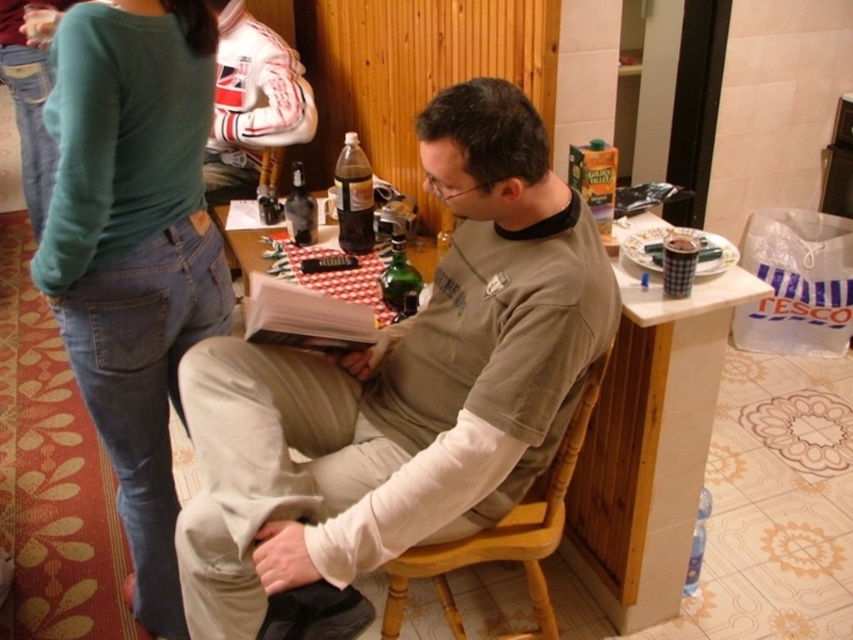
Question: Can you confirm if matte gray shirt at center is thinner than wooden chair at center?

Choices:
 (A) yes
 (B) no

Answer: (B)

Question: Which of the following is the farthest from the observer?

Choices:
 (A) (317, 460)
 (B) (131, 102)

Answer: (A)

Question: Does green cotton sweater at upper left appear on the left side of dark brown glass bottle at center?

Choices:
 (A) yes
 (B) no

Answer: (A)

Question: Does matte gray shirt at center appear under wooden chair at center?

Choices:
 (A) no
 (B) yes

Answer: (A)

Question: Which object is the farthest from the matte gray shirt at center?

Choices:
 (A) green cotton sweater at upper left
 (B) wooden chair at center
 (C) green glass bottle at center
 (D) dark brown glass bottle at center

Answer: (D)

Question: Which object appears farthest from the camera in this image?

Choices:
 (A) green glass bottle at center
 (B) green cotton sweater at upper left
 (C) dark brown glass bottle at center

Answer: (C)